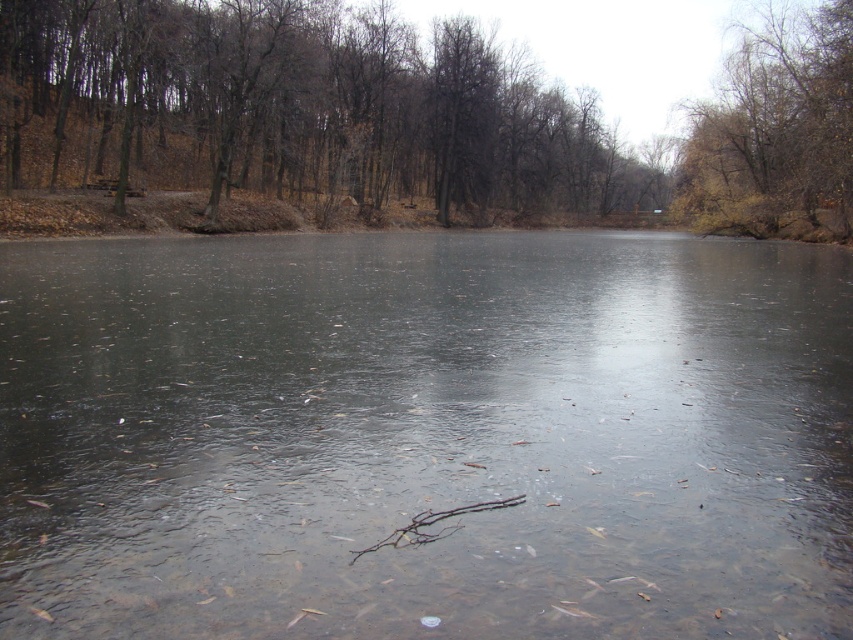
Question: Considering the real-world distances, which object is farthest from the brown/dry wood branch at center?

Choices:
 (A) brown/dry wood at left
 (B) transparent ice at center

Answer: (A)

Question: Which object is the closest to the brown leafy tree at upper right?

Choices:
 (A) transparent ice at center
 (B) brown/dry wood at left
 (C) brown/dry wood branch at center

Answer: (B)

Question: Considering the relative positions of brown/dry wood at left and brown leafy tree at upper right in the image provided, where is brown/dry wood at left located with respect to brown leafy tree at upper right?

Choices:
 (A) right
 (B) left

Answer: (B)

Question: Is brown leafy tree at upper right wider than brown/dry wood branch at center?

Choices:
 (A) no
 (B) yes

Answer: (B)

Question: Where is transparent ice at center located in relation to brown/dry wood branch at center in the image?

Choices:
 (A) above
 (B) below

Answer: (A)

Question: Which point is farther from the camera taking this photo?

Choices:
 (A) tap(434, 602)
 (B) tap(48, 38)
 (C) tap(691, 141)
 (D) tap(434, 516)

Answer: (C)